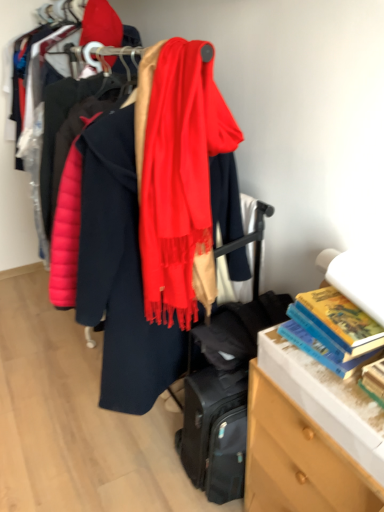
Question: From a real-world perspective, relative to hardcover book at right, the second book viewed from the front, is silky red scarf at center vertically above or below?

Choices:
 (A) below
 (B) above

Answer: (B)

Question: In the image, is silky red scarf at center positioned in front of or behind hardcover book at right, the second book viewed from the front?

Choices:
 (A) behind
 (B) front

Answer: (B)

Question: Which of these objects is positioned farthest from the silky red scarf at center?

Choices:
 (A) hardcover book at right, the first book when ordered from front to back
 (B) wooden chest of drawers at lower right
 (C) hardcover book at right, the second book viewed from the front

Answer: (A)

Question: Estimate the real-world distances between objects in this image. Which object is closer to the hardcover book at right, the 1th book positioned from the back?

Choices:
 (A) silky red scarf at center
 (B) wooden chest of drawers at lower right
 (C) hardcover book at right, acting as the second book starting from the back

Answer: (C)